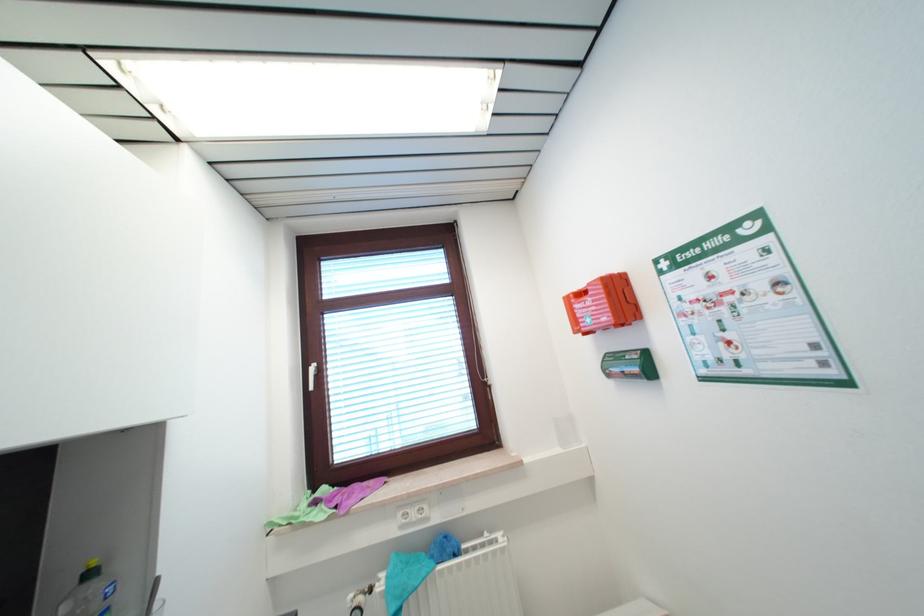
You are a GUI agent. You are given a task and a screenshot of the screen. Output one action in this format:
    pyautogui.click(x=<x>, y=<y>)
    Task: Click on the blue cloth
    This screenshot has width=924, height=616.
    Given the screenshot: What is the action you would take?
    pyautogui.click(x=415, y=570)